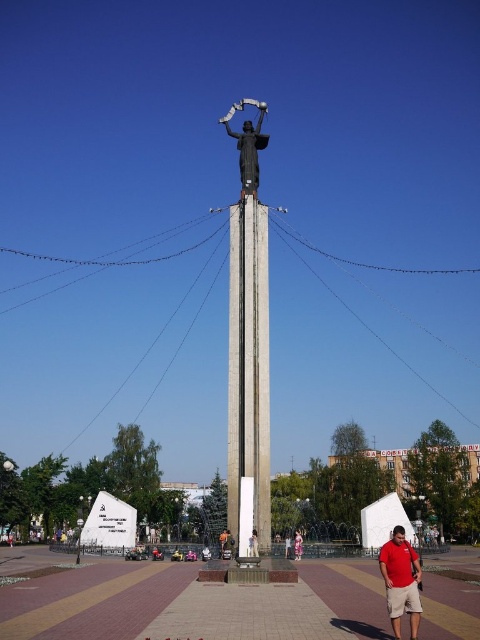
Can you confirm if pink fabric dress at center is positioned to the right of matte black statue at center?

Correct, you'll find pink fabric dress at center to the right of matte black statue at center.

Who is shorter, pink fabric dress at center or matte black statue at center?

pink fabric dress at center is shorter.

Does point (296, 548) lie in front of point (287, 556)?

No, (296, 548) is further to viewer.

The image size is (480, 640). Identify the location of pink fabric dress at center. [x=298, y=545].

Who is positioned more to the right, orange fabric bag at center or matte black statue at center?

matte black statue at center is more to the right.

Does orange fabric bag at center have a greater height compared to matte black statue at center?

No.

I want to click on orange fabric bag at center, so click(224, 541).

Can you confirm if concrete column at center is positioned above pink fabric dress at center?

Yes.

Does concrete column at center lie behind pink fabric dress at center?

No, it is in front of pink fabric dress at center.

Does point (237, 227) come closer to viewer compared to point (296, 556)?

No, (237, 227) is further to viewer.

Where is `concrete column at center`? This screenshot has height=640, width=480. concrete column at center is located at coordinates (249, 364).